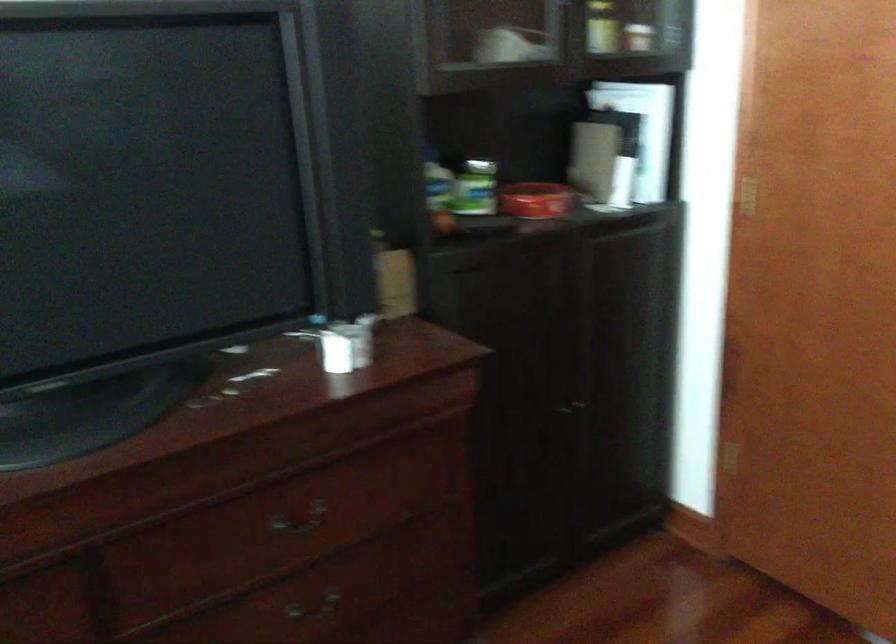
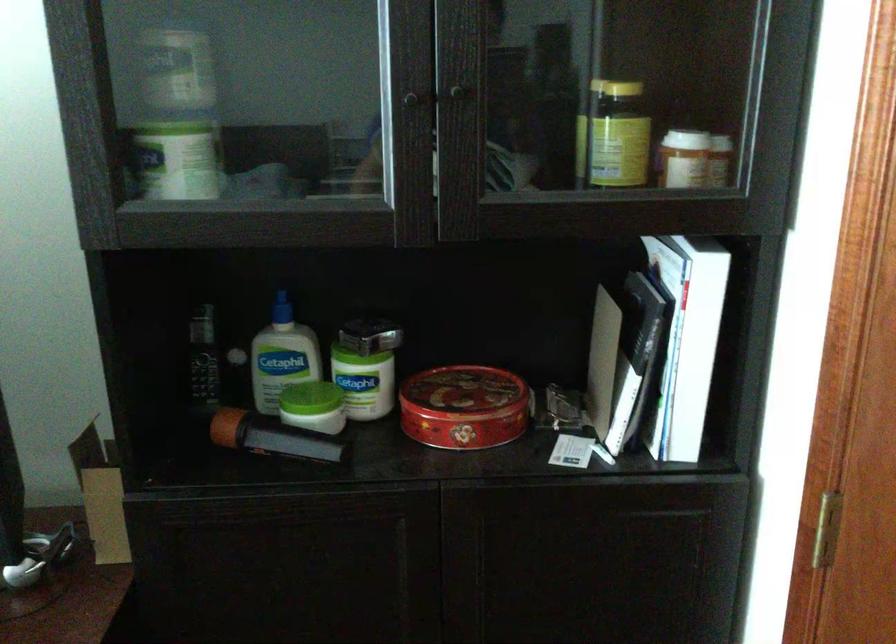
The point at (x=464, y=220) is marked in the first image. Where is the corresponding point in the second image?

(268, 436)